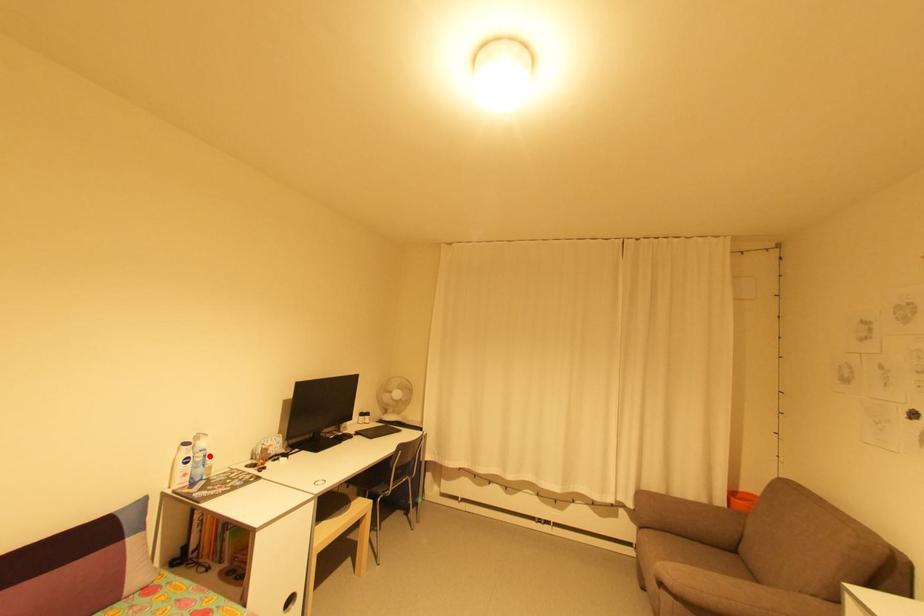
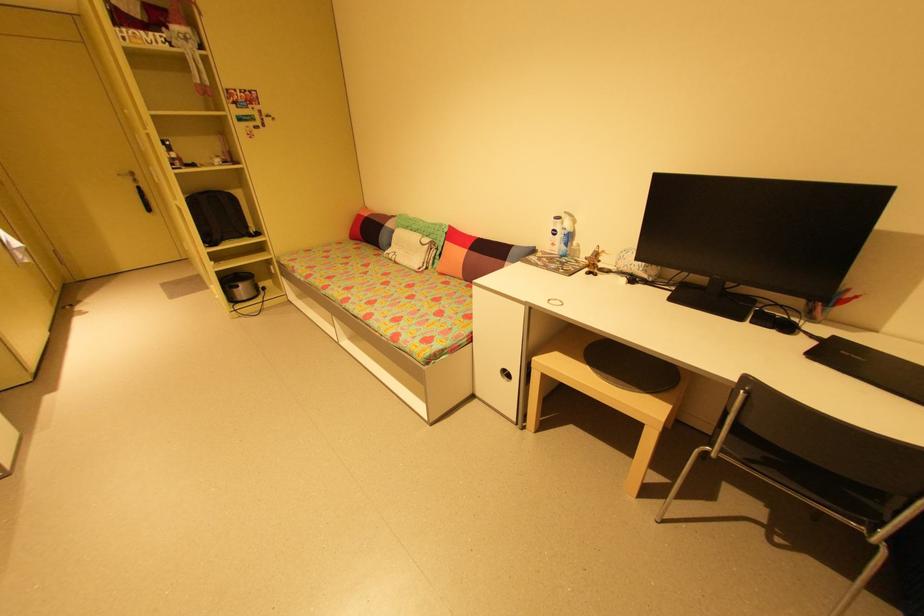
In the second image, find the point that corresponds to the highlighted location in the first image.

(574, 237)